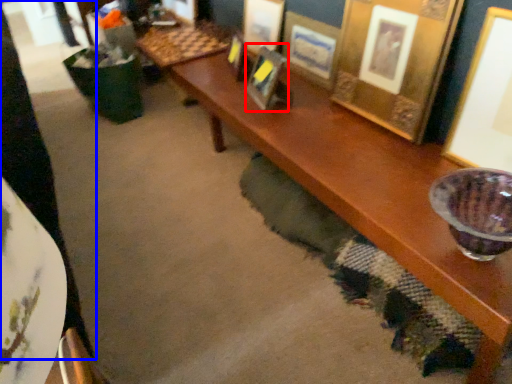
Question: Among these objects, which one is farthest to the camera, picture frame (highlighted by a red box) or person (highlighted by a blue box)?

Choices:
 (A) picture frame
 (B) person

Answer: (A)